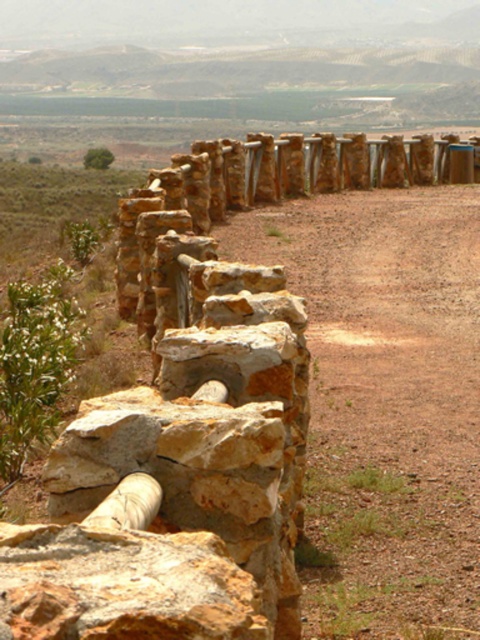
Is brown gravel path at center further to camera compared to rusty stone wall at center?

Yes, it is.

Is brown gravel path at center below rusty stone wall at center?

Incorrect, brown gravel path at center is not positioned below rusty stone wall at center.

Who is more forward, (316,256) or (168,593)?

Point (168,593) is more forward.

This screenshot has width=480, height=640. What are the coordinates of `brown gravel path at center` in the screenshot? It's located at (385, 403).